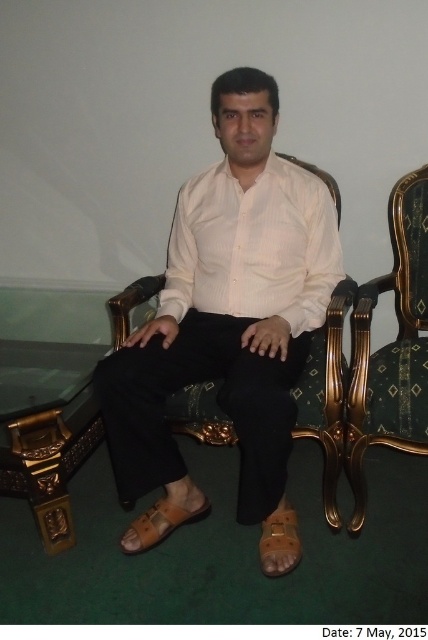
Question: Does matte white shirt at center appear on the right side of white ribbed shirt at center?

Choices:
 (A) no
 (B) yes

Answer: (A)

Question: Which object appears closest to the camera in this image?

Choices:
 (A) white ribbed shirt at center
 (B) velvet green armchair at right
 (C) brown leather sandal at lower center

Answer: (B)

Question: Which point appears closest to the camera in this image?

Choices:
 (A) (267, 564)
 (B) (165, 305)
 (C) (400, 301)
 (D) (175, 518)

Answer: (A)

Question: Is matte white shirt at center smaller than brown leather sandal at lower center?

Choices:
 (A) yes
 (B) no

Answer: (B)

Question: Does matte white shirt at center appear on the left side of white ribbed shirt at center?

Choices:
 (A) no
 (B) yes

Answer: (B)

Question: Which is nearer to the tan leather sandal at lower center?

Choices:
 (A) matte white shirt at center
 (B) white ribbed shirt at center
 (C) brown leather sandal at lower center

Answer: (C)